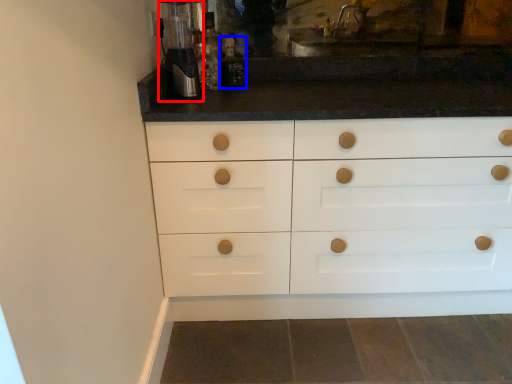
Question: Which object is closer to the camera taking this photo, coffee machine (highlighted by a red box) or bottle (highlighted by a blue box)?

Choices:
 (A) coffee machine
 (B) bottle

Answer: (A)